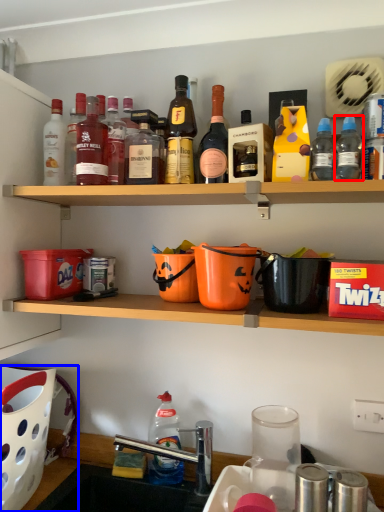
Question: Which object appears farthest to the camera in this image, bottle (highlighted by a red box) or basket (highlighted by a blue box)?

Choices:
 (A) bottle
 (B) basket

Answer: (B)